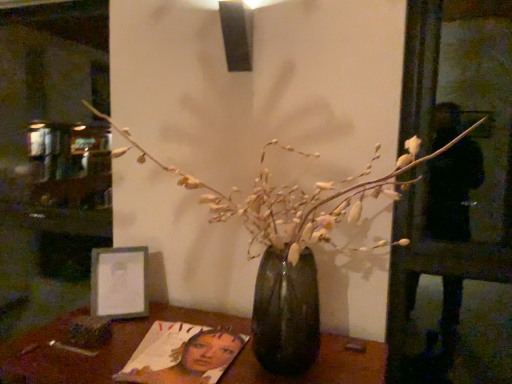
Question: Can you confirm if wooden table at center is shorter than translucent glass vase at center?

Choices:
 (A) yes
 (B) no

Answer: (A)

Question: Is wooden table at center to the left of translucent glass vase at center from the viewer's perspective?

Choices:
 (A) no
 (B) yes

Answer: (B)

Question: Can you confirm if wooden table at center is wider than translucent glass vase at center?

Choices:
 (A) no
 (B) yes

Answer: (A)

Question: Is wooden table at center positioned with its back to translucent glass vase at center?

Choices:
 (A) yes
 (B) no

Answer: (B)

Question: From the image's perspective, would you say wooden table at center is positioned over translucent glass vase at center?

Choices:
 (A) no
 (B) yes

Answer: (A)

Question: Is there a large distance between wooden table at center and translucent glass vase at center?

Choices:
 (A) yes
 (B) no

Answer: (B)

Question: From a real-world perspective, does metallic silver frame at lower left sit lower than wooden table at center?

Choices:
 (A) yes
 (B) no

Answer: (B)

Question: Would you consider metallic silver frame at lower left to be distant from wooden table at center?

Choices:
 (A) yes
 (B) no

Answer: (B)

Question: Is wooden table at center completely or partially inside metallic silver frame at lower left?

Choices:
 (A) no
 (B) yes

Answer: (A)

Question: Is metallic silver frame at lower left taller than wooden table at center?

Choices:
 (A) yes
 (B) no

Answer: (B)

Question: Is metallic silver frame at lower left positioned before wooden table at center?

Choices:
 (A) no
 (B) yes

Answer: (A)

Question: Is metallic silver frame at lower left completely or partially outside of wooden table at center?

Choices:
 (A) no
 (B) yes

Answer: (B)

Question: Can you confirm if metallic silver frame at lower left is bigger than translucent glass vase at center?

Choices:
 (A) yes
 (B) no

Answer: (B)